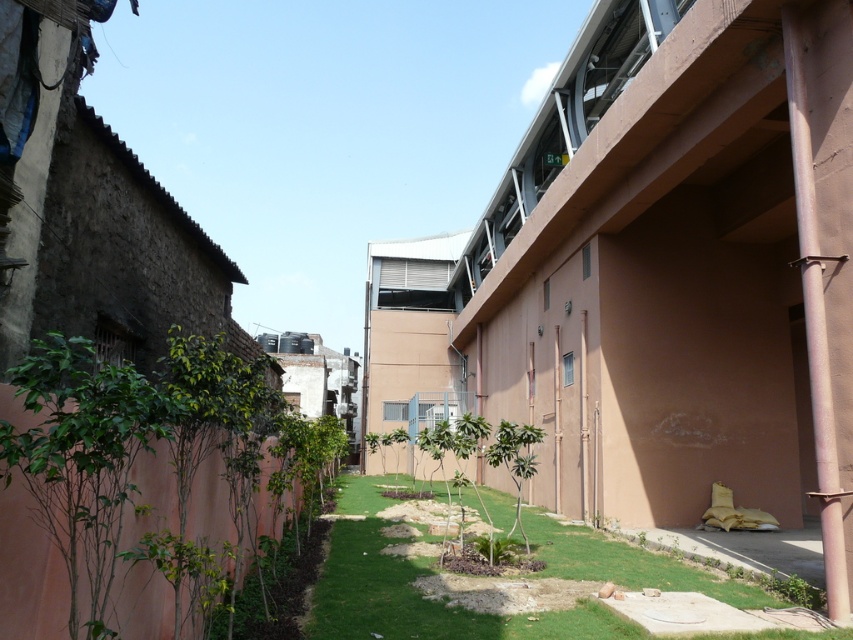
You are standing at the entrance of the pathway and want to walk to the end. Given the coordinates of the green grass at center, which is at point 0.923, 0.489, can you determine if the grass is located closer to the left or right wall?

The green grass at center is located at coordinates (416, 589). Since the x coordinate is closer to 1, it is closer to the right wall.

You are standing at the point marked as point (416,589) in the image. Based on the scene description, what type of terrain are you currently standing on?

The point (416,589) is on green grass at center, so you are standing on green grass.

You are a gardener planning to plant flowers along the pathway. You have two spots in mind near the green grass at center and the brown concrete pipe at right. Which spot is closer to the ground level?

The green grass at center is located below the brown concrete pipe at right, so the green grass at center is closer to the ground level.